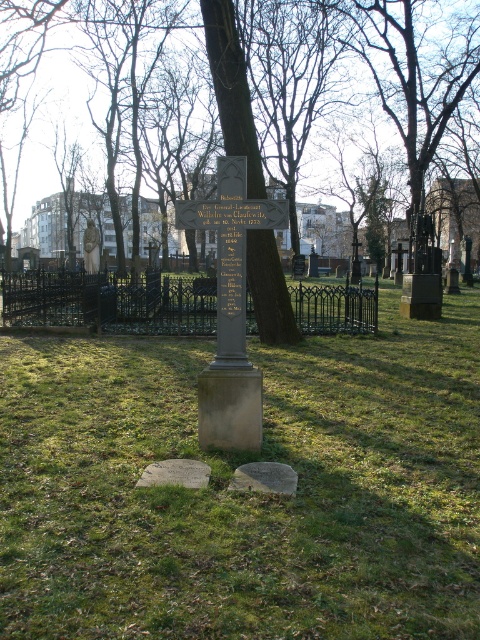
Question: Which is farther from the green leafy tree at center?

Choices:
 (A) green grass at center
 (B) bronze statue at left

Answer: (B)

Question: Which object appears closest to the camera in this image?

Choices:
 (A) green grass at center
 (B) green leafy tree at center

Answer: (A)

Question: Does green grass at center have a lesser width compared to green leafy tree at center?

Choices:
 (A) no
 (B) yes

Answer: (B)

Question: From the image, what is the correct spatial relationship of green grass at center in relation to bronze statue at left?

Choices:
 (A) below
 (B) above

Answer: (A)

Question: Which of the following is the closest to the observer?

Choices:
 (A) (256, 317)
 (B) (85, 260)
 (C) (162, 344)

Answer: (A)

Question: Is green grass at center below green leafy tree at center?

Choices:
 (A) yes
 (B) no

Answer: (A)